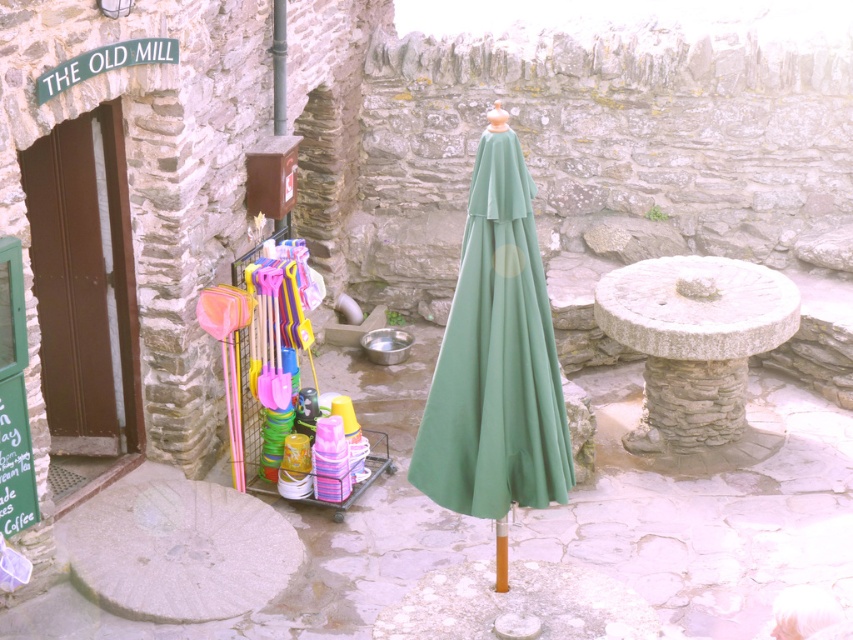
Between stone millstone at center and metallic pole at center, which one appears on the left side from the viewer's perspective?

Positioned to the left is metallic pole at center.

Does point (709, 342) come behind point (276, 3)?

No, it is in front of (276, 3).

What do you see at coordinates (695, 348) in the screenshot? I see `stone millstone at center` at bounding box center [695, 348].

Identify the location of stone millstone at center. (695, 348).

Between multicolored plastic utensils at center and metallic pole at center, which one has less height?

metallic pole at center is shorter.

I want to click on multicolored plastic utensils at center, so click(258, 371).

Is stone millstone at center closer to the viewer compared to orange matte pole at center?

No, it is behind orange matte pole at center.

Describe the element at coordinates (695, 348) in the screenshot. The width and height of the screenshot is (853, 640). I see `stone millstone at center` at that location.

Describe the element at coordinates (695, 348) in the screenshot. Image resolution: width=853 pixels, height=640 pixels. I see `stone millstone at center` at that location.

Where is `stone millstone at center`? stone millstone at center is located at coordinates (695, 348).